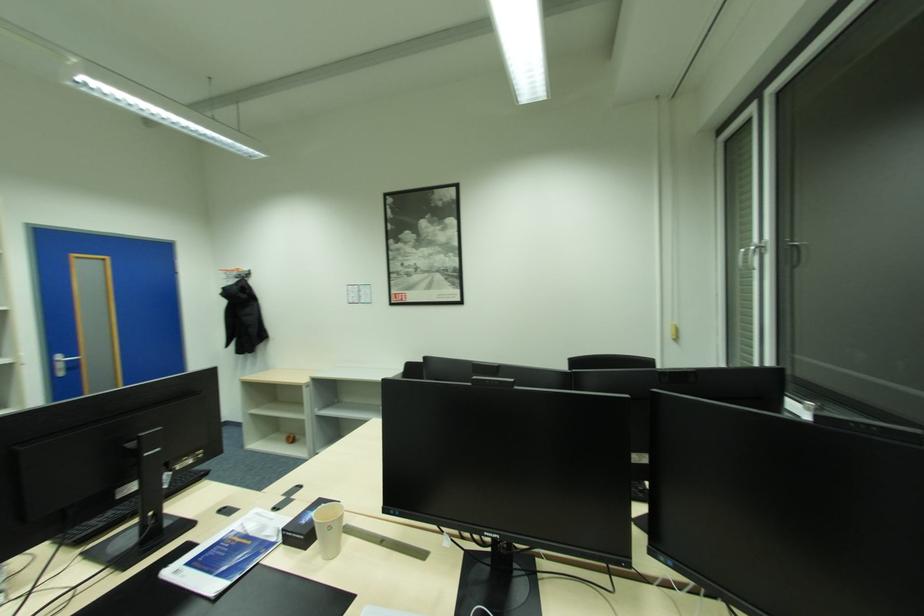
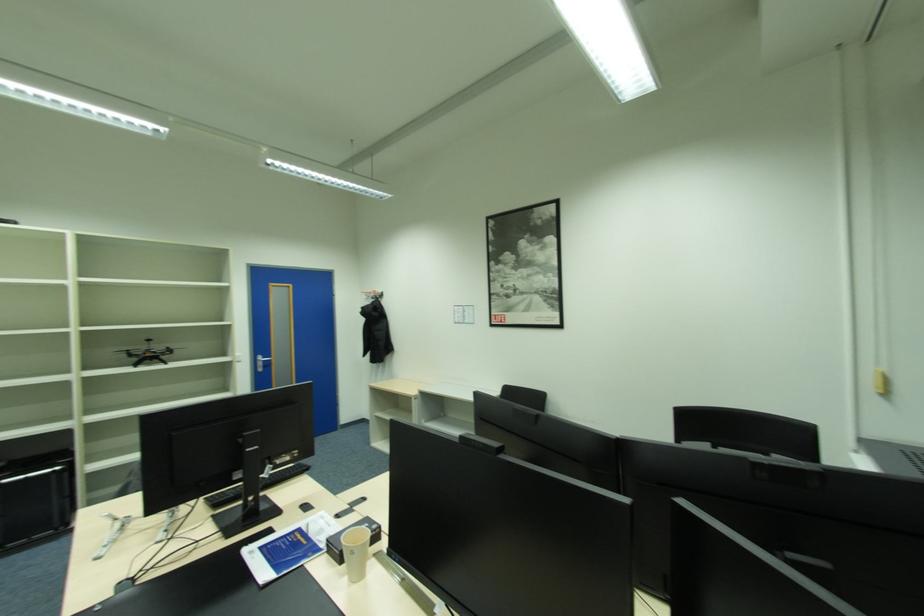
In a continuous first-person perspective shot, in which direction is the camera moving?

The cameraman moved toward right, forward.